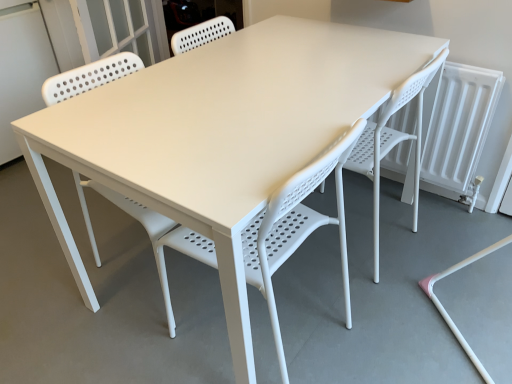
I want to click on vacant space situated on the left part of white plastic chair at center, the 1th chair positioned from the left, so (135, 346).